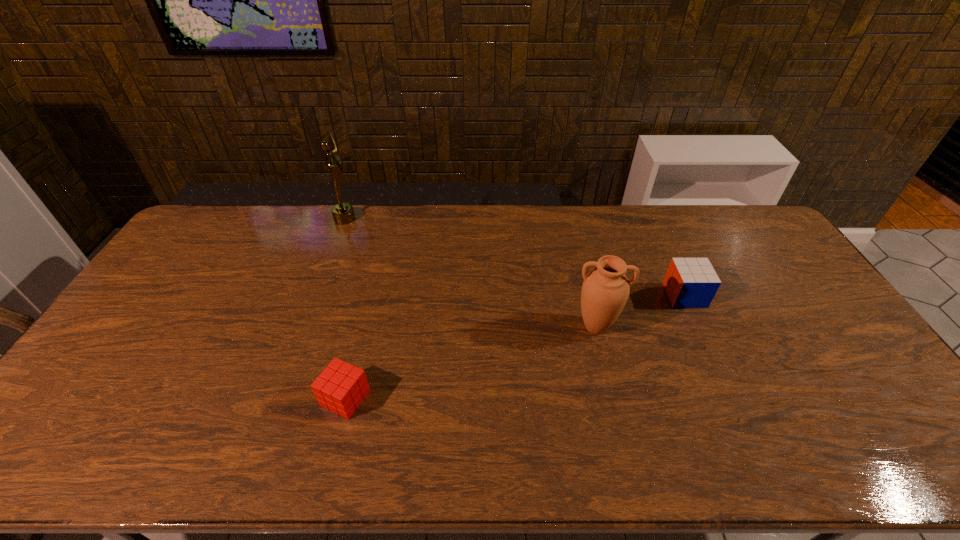
This screenshot has height=540, width=960. I want to click on free space located 0.180m on the left of the right cube, so (x=610, y=295).

The width and height of the screenshot is (960, 540). What are the coordinates of `vacant area situated 0.370m on the left of the nearer cube` in the screenshot? It's located at (176, 398).

Locate an element on the screen. This screenshot has width=960, height=540. object located at the far edge is located at coordinates (343, 213).

In the image, there is a desktop. Where is `vacant space at the far edge`? vacant space at the far edge is located at coordinates (527, 244).

In the image, there is a desktop. Where is `vacant area at the near edge`? The width and height of the screenshot is (960, 540). vacant area at the near edge is located at coordinates (625, 461).

Where is `vacant space at the left edge of the desktop`? vacant space at the left edge of the desktop is located at coordinates (166, 268).

Identify the location of vacant region at the right edge of the desktop. The width and height of the screenshot is (960, 540). click(x=828, y=337).

The height and width of the screenshot is (540, 960). Find the location of `vacant space at the near right corner of the desktop`. vacant space at the near right corner of the desktop is located at coordinates (885, 463).

Locate an element on the screen. free area in between the third shortest object and the farthest object is located at coordinates (470, 273).

Locate an element on the screen. The image size is (960, 540). vacant space that's between the third farthest object and the shortest object is located at coordinates (470, 362).